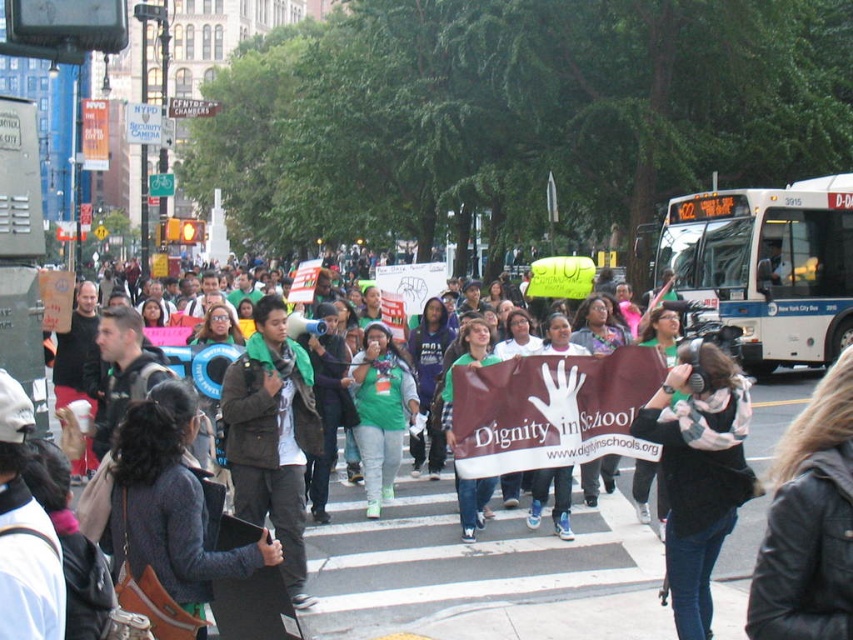
In the scene shown: Does brown leather jacket at center appear over green matte jacket at center?

Correct, brown leather jacket at center is located above green matte jacket at center.

Does point (236, 445) lie in front of point (389, 422)?

Yes, point (236, 445) is in front of point (389, 422).

Is point (270, 480) more distant than point (376, 468)?

No, it is not.

What are the coordinates of `brown leather jacket at center` in the screenshot? It's located at (271, 435).

Which is more to the left, flannel shirt at center or green matte jacket at center?

green matte jacket at center is more to the left.

Measure the distance between point (668,557) and camera.

Point (668,557) and camera are 31.76 meters apart.

Is point (682, 580) farther from viewer compared to point (379, 381)?

That is False.

Locate an element on the screen. The height and width of the screenshot is (640, 853). flannel shirt at center is located at coordinates (698, 472).

Looking at this image, who is shorter, white/blue metallic bus at upper right or green matte jacket at center?

green matte jacket at center is shorter.

In the scene shown: Between white/blue metallic bus at upper right and green matte jacket at center, which one is positioned lower?

Positioned lower is green matte jacket at center.

The height and width of the screenshot is (640, 853). I want to click on white/blue metallic bus at upper right, so click(769, 266).

The image size is (853, 640). Identify the location of white/blue metallic bus at upper right. (769, 266).